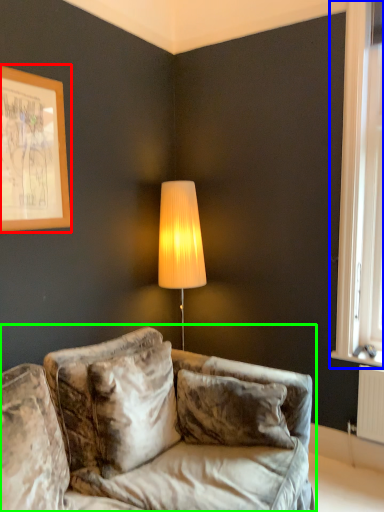
Question: Considering the real-world distances, which object is farthest from picture frame (highlighted by a red box)? window (highlighted by a blue box) or studio couch (highlighted by a green box)?

Choices:
 (A) window
 (B) studio couch

Answer: (A)